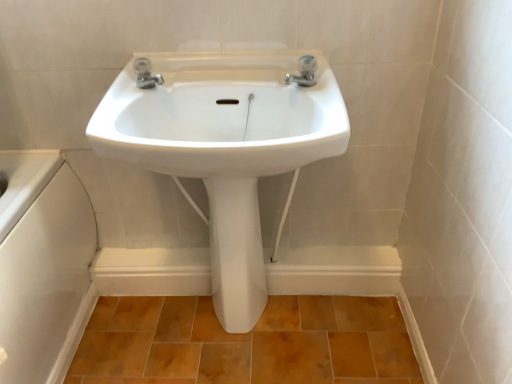
Question: Considering the relative sizes of satin nickel faucet at upper center, acting as the first tap starting from the left, and white glossy sink at center in the image provided, is satin nickel faucet at upper center, acting as the first tap starting from the left, wider than white glossy sink at center?

Choices:
 (A) yes
 (B) no

Answer: (B)

Question: From the image's perspective, does satin nickel faucet at upper center, acting as the first tap starting from the left, appear lower than white glossy sink at center?

Choices:
 (A) no
 (B) yes

Answer: (A)

Question: Can you see satin nickel faucet at upper center, the second tap from the right, touching white glossy sink at center?

Choices:
 (A) yes
 (B) no

Answer: (B)

Question: Can you confirm if satin nickel faucet at upper center, the second tap from the right, is shorter than white glossy sink at center?

Choices:
 (A) no
 (B) yes

Answer: (B)

Question: Considering the relative sizes of satin nickel faucet at upper center, the second tap from the right, and white glossy sink at center in the image provided, is satin nickel faucet at upper center, the second tap from the right, taller than white glossy sink at center?

Choices:
 (A) no
 (B) yes

Answer: (A)

Question: Considering the relative positions of satin nickel faucet at upper center, acting as the first tap starting from the left, and white glossy sink at center in the image provided, is satin nickel faucet at upper center, acting as the first tap starting from the left, to the left of white glossy sink at center from the viewer's perspective?

Choices:
 (A) no
 (B) yes

Answer: (B)

Question: Is white glossy pedestal at center facing towards white glossy sink at center?

Choices:
 (A) yes
 (B) no

Answer: (B)

Question: Considering the relative sizes of white glossy pedestal at center and white glossy sink at center in the image provided, is white glossy pedestal at center wider than white glossy sink at center?

Choices:
 (A) yes
 (B) no

Answer: (B)

Question: Would you say white glossy sink at center is part of white glossy pedestal at center's contents?

Choices:
 (A) yes
 (B) no

Answer: (B)

Question: Would you say white glossy pedestal at center is outside white glossy sink at center?

Choices:
 (A) no
 (B) yes

Answer: (B)

Question: Does white glossy pedestal at center appear on the right side of white glossy sink at center?

Choices:
 (A) no
 (B) yes

Answer: (B)

Question: Is white glossy pedestal at center to the left of white glossy sink at center from the viewer's perspective?

Choices:
 (A) yes
 (B) no

Answer: (B)

Question: Considering the relative sizes of brown matte tile at lower center and white glossy pedestal at center in the image provided, is brown matte tile at lower center taller than white glossy pedestal at center?

Choices:
 (A) no
 (B) yes

Answer: (A)